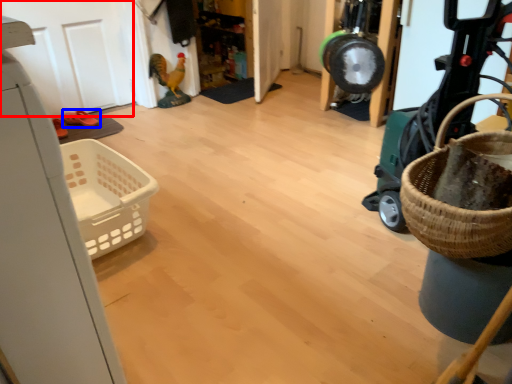
Question: Which object is further to the camera taking this photo, door (highlighted by a red box) or footwear (highlighted by a blue box)?

Choices:
 (A) door
 (B) footwear

Answer: (B)